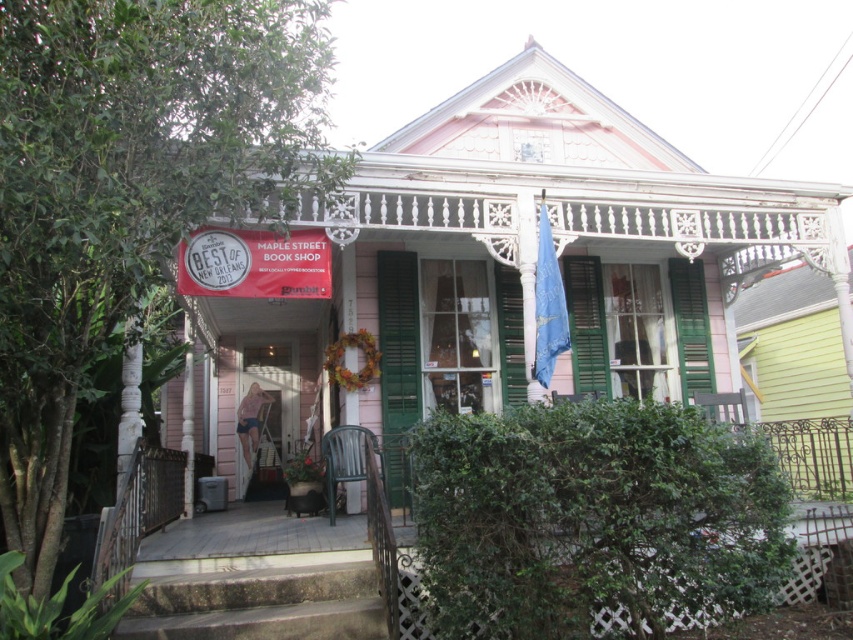
You are standing in front of the house and see the green plastic chair at lower center and the green matte shutter at center. Which object is positioned to the right of the other?

The green plastic chair at lower center is positioned to the right of the green matte shutter at center.

You are a customer visiting the Maple Street Book Shop. You see the green plastic chair at lower center and the green matte shutter at center. Which object would be more suitable for sitting on?

The green plastic chair at lower center is larger in size compared to the green matte shutter at center, making it more suitable for sitting.

You are a delivery person carrying a large package that requires a 3 meter clearance to maneuver. You need to move from the green plastic chair at lower center to the green matte shutter at center. Is there enough space for you to move through this path?

The green plastic chair at lower center is 2.76 meters away from the green matte shutter at center. Since the required clearance is 3 meters and the distance is less than that, there isn not enough space for the delivery person to maneuver the package through this path.